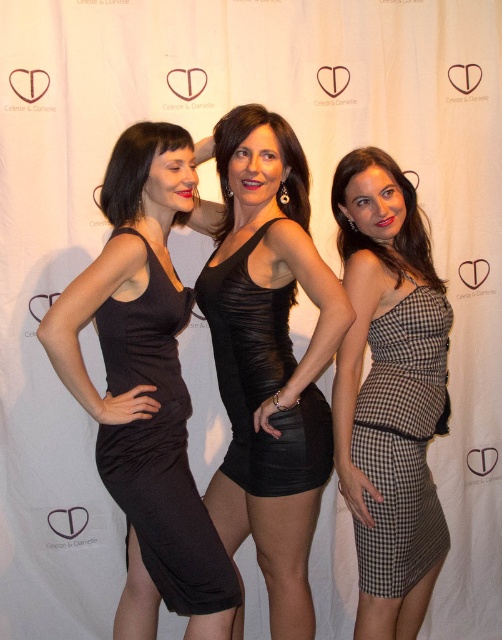
You are a photographer adjusting your camera to focus on two specific points in the image. The first point is at coordinates point (437, 502) and the second is at point (238, 435). Which point should you focus on first if you want to ensure the closest object is in sharp focus?

Point (437, 502) is further to the camera than point (238, 435), so you should focus on point (437, 502) first to ensure the closest object is in sharp focus.

You are a photographer setting up for a photoshoot. You need to place a small prop exactly where the shiny black dress at center is located. According to the coordinates provided, where should you position the prop?

The shiny black dress at center is located at point (268, 355), so you should position the prop at those coordinates to match its location.

You are a photographer setting up a shoot with three women wearing different dresses. The scene includes a woman in a sleeveless black dress with a fitted waist on the left, a woman in a black ruched mini dress in the center, and a woman wearing a checkered fabric dress at right. Based on their positions, which dress is positioned farthest to the right?

The checkered fabric dress at right is positioned farthest to the right as it is located at point [402,444].